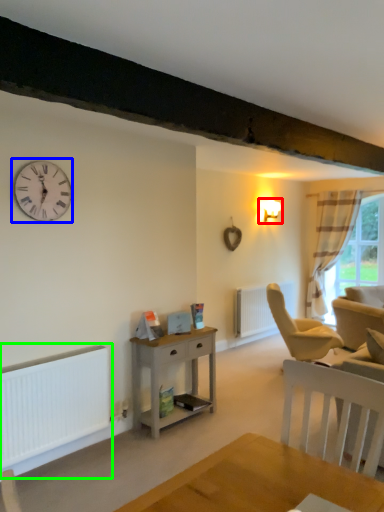
Question: Estimate the real-world distances between objects in this image. Which object is closer to light fixture (highlighted by a red box), wall clock (highlighted by a blue box) or heater (highlighted by a green box)?

Choices:
 (A) wall clock
 (B) heater

Answer: (A)